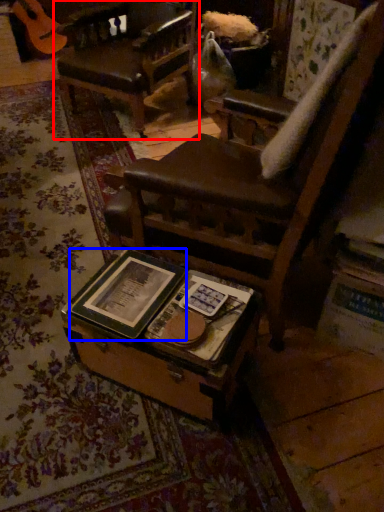
Question: Which object appears closest to the camera in this image, chair (highlighted by a red box) or paperback book (highlighted by a blue box)?

Choices:
 (A) chair
 (B) paperback book

Answer: (B)